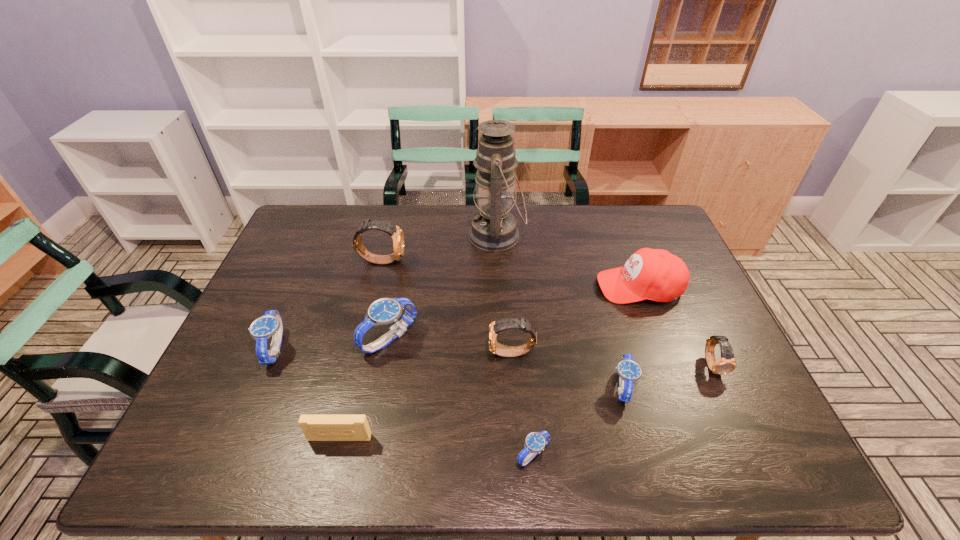
You are a GUI agent. You are given a task and a screenshot of the screen. Output one action in this format:
    pyautogui.click(x=<x>, y=<y>)
    Task: Click on the object that is the third closest one to the third blue watch from left to right
    This screenshot has height=540, width=960.
    Given the screenshot: What is the action you would take?
    pyautogui.click(x=315, y=427)

Where is `object that is the fifth closest to the leftmost blue watch`? The image size is (960, 540). object that is the fifth closest to the leftmost blue watch is located at coordinates (493, 229).

Identify which watch is located as the nearest to the ninth shortest object. Please provide its 2D coordinates. Your answer should be formatted as a tuple, i.e. [(x, y)], where the tuple contains the x and y coordinates of a point satisfying the conditions above.

[(384, 311)]

Locate an element on the screen. Image resolution: width=960 pixels, height=540 pixels. watch object that ranks as the sixth closest to the beige videotape is located at coordinates (629, 372).

I want to click on gold watch that is the second closest to the beige videotape, so click(395, 232).

Identify which gold watch is the second nearest to the second tallest object. Please provide its 2D coordinates. Your answer should be formatted as a tuple, i.e. [(x, y)], where the tuple contains the x and y coordinates of a point satisfying the conditions above.

[(726, 364)]

Image resolution: width=960 pixels, height=540 pixels. What are the coordinates of `the second closest blue watch to the tallest object` in the screenshot? It's located at (629, 372).

Where is `blue watch that stands as the third closest to the leftmost watch`? blue watch that stands as the third closest to the leftmost watch is located at coordinates (629, 372).

I want to click on vacant region that satisfies the following two spatial constraints: 1. on the back side of the second blue watch from left to right; 2. on the left side of the tallest object, so click(409, 235).

At what (x,y) coordinates should I click in order to perform the action: click on free space that satisfies the following two spatial constraints: 1. on the face of the farthest watch; 2. on the back side of the nearest blue watch. Please return your answer as a coordinate pair (x, y). Image resolution: width=960 pixels, height=540 pixels. Looking at the image, I should click on (333, 454).